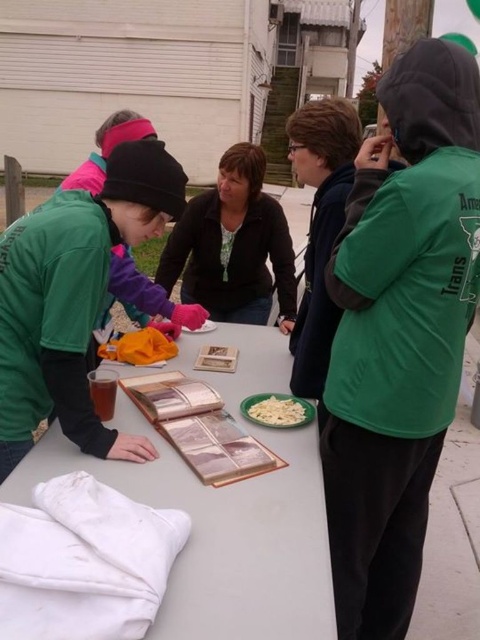
You are organizing a community event and need to decide which clothing item to use for a promotional photo. The green matte hoodie at upper right and the green matte jacket at center are both available. Which item is larger in size?

The green matte hoodie at upper right is bigger than the green matte jacket at center, so it would be the larger option for the promotional photo.

You are organizing a community event and need to place a 12 inch wide decorative plate on the table. Given the green matte jacket at center and the white creamy pasta at center, which object can you place the plate next to without overlapping?

The green matte jacket at center has a larger width than the white creamy pasta at center, so the plate can be placed next to the green matte jacket at center without overlapping.

Where is the green matte hoodie at upper right located in the image?

The green matte hoodie at upper right is located at point [399,332] in the image.